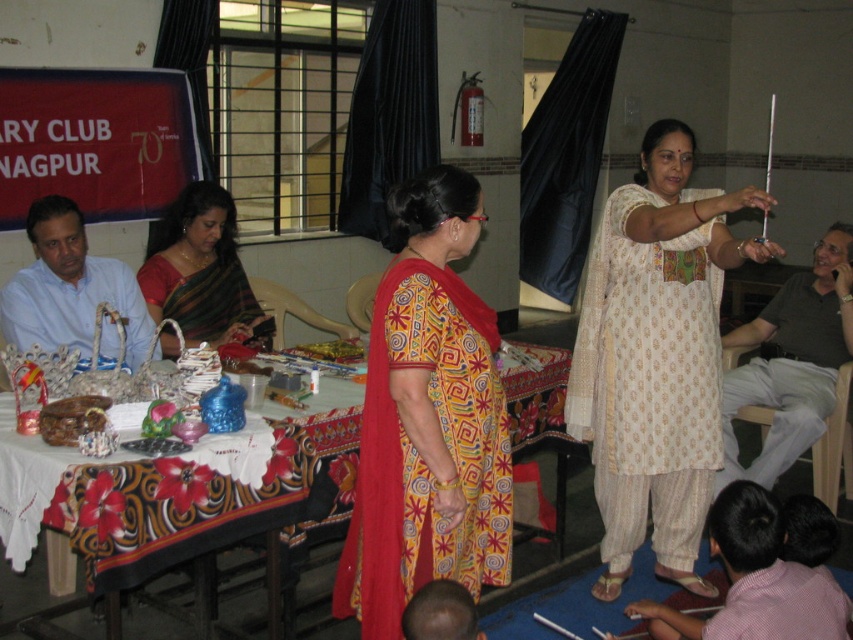
Question: In this image, where is white printed kurta at center located relative to green silk saree at center?

Choices:
 (A) below
 (B) above

Answer: (A)

Question: Which point appears farthest from the camera in this image?

Choices:
 (A) (198, 269)
 (B) (444, 356)
 (C) (776, 573)

Answer: (A)

Question: Estimate the real-world distances between objects in this image. Which object is farther from the yellow printed dress at center?

Choices:
 (A) pink cotton shirt at lower right
 (B) white printed kurta at center
 (C) patterned fabric table at center

Answer: (B)

Question: Estimate the real-world distances between objects in this image. Which object is farther from the white printed kurta at center?

Choices:
 (A) yellow printed dress at center
 (B) patterned fabric table at center

Answer: (B)

Question: Does pink cotton shirt at lower right lie behind green silk saree at center?

Choices:
 (A) no
 (B) yes

Answer: (A)

Question: Does yellow printed dress at center appear under green silk saree at center?

Choices:
 (A) yes
 (B) no

Answer: (A)